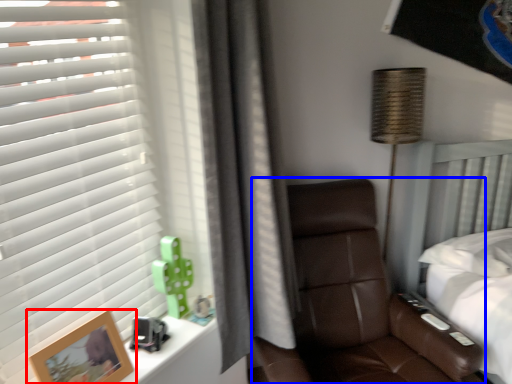
Question: Among these objects, which one is nearest to the camera, picture frame (highlighted by a red box) or chair (highlighted by a blue box)?

Choices:
 (A) picture frame
 (B) chair

Answer: (A)